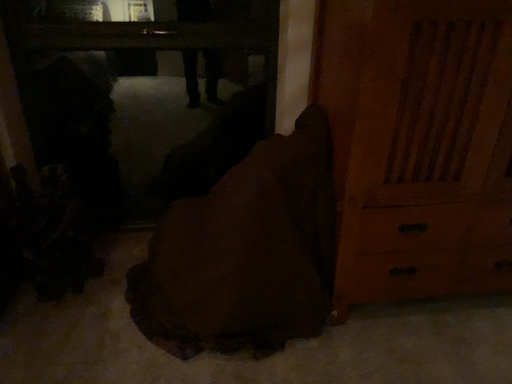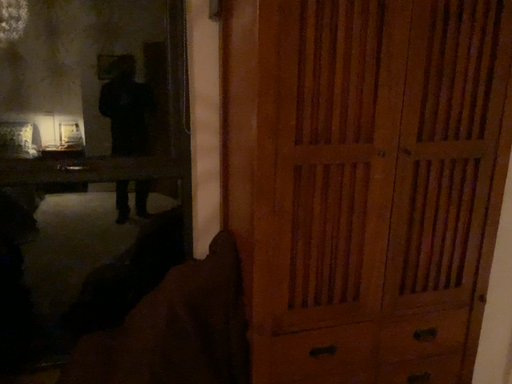
Question: Which way did the camera rotate in the video?

Choices:
 (A) rotated right
 (B) rotated left

Answer: (A)